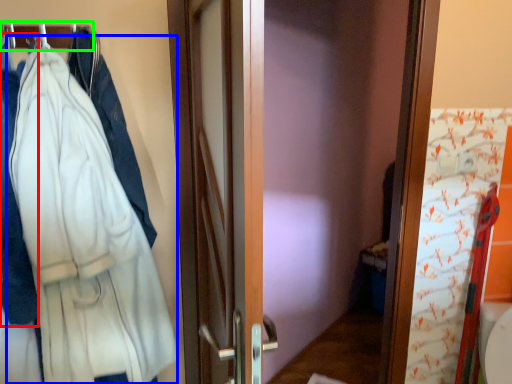
Question: Which object is positioned closest to garment (highlighted by a red box)? Select from bathrobe (highlighted by a blue box) and hanger (highlighted by a green box).

Choices:
 (A) bathrobe
 (B) hanger

Answer: (A)